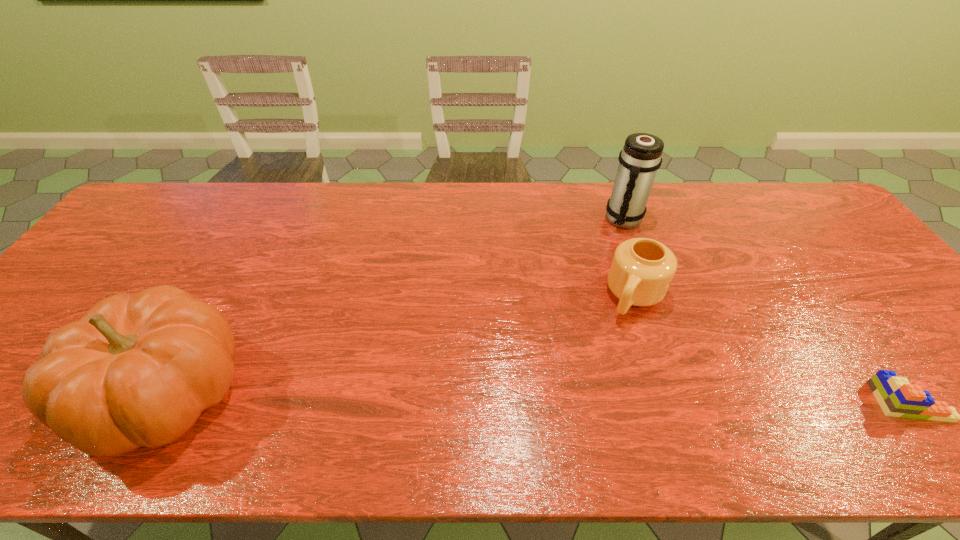
Identify the location of vacant spot on the desktop that is between the leftmost object and the shortest object and is positioned on the handle side of the second farthest object. (582, 397).

Image resolution: width=960 pixels, height=540 pixels. I want to click on free spot on the desktop that is between the leftmost object and the shortest object and is positioned on the side with the handle of the thermos bottle, so click(617, 397).